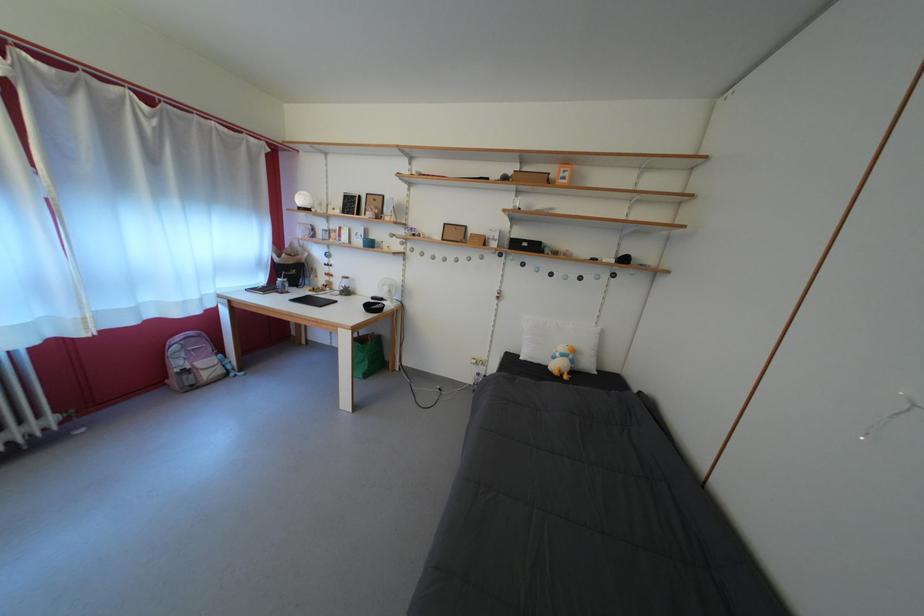
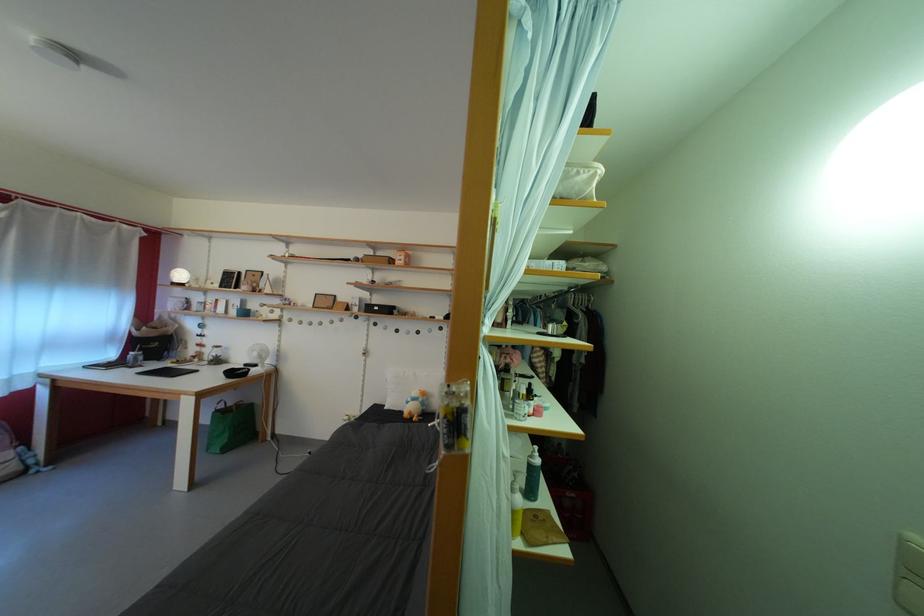
Where in the second image is the point corresponding to point 362,346 from the first image?

(225, 416)